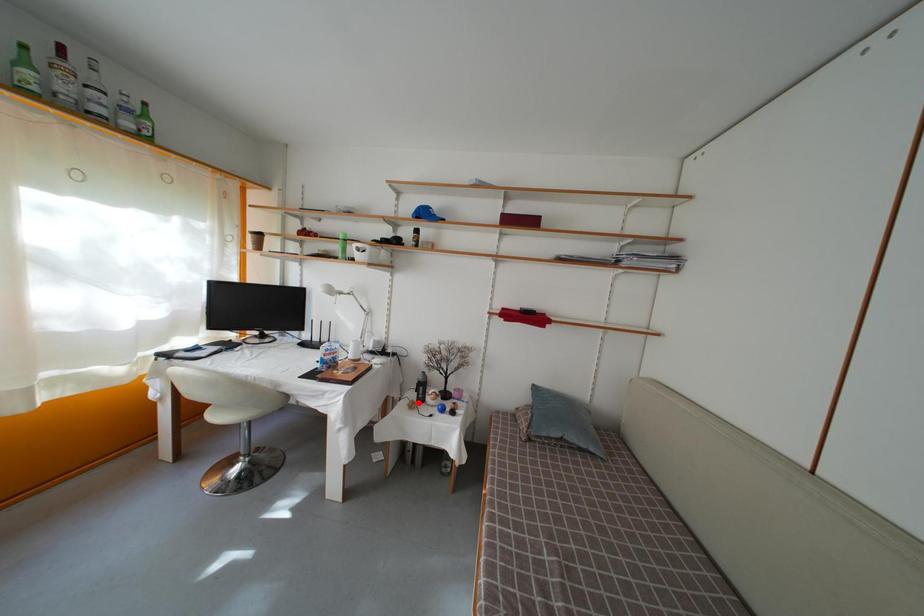
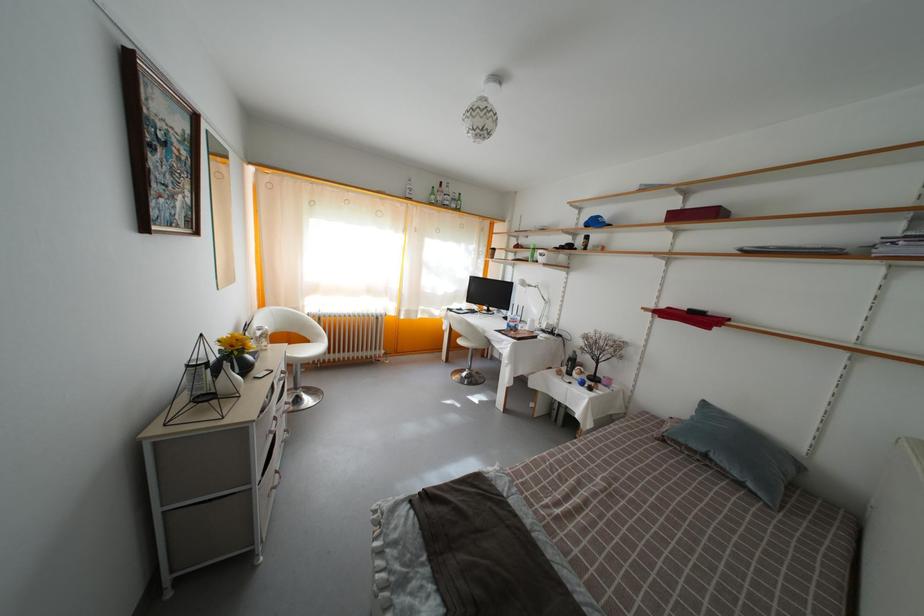
Question: I am providing you with two images of the same scene from different viewpoints. A red point is marked on the first image. At the location where the point appears in image 1, is it still visible in image 2?

Choices:
 (A) Yes
 (B) No

Answer: (A)